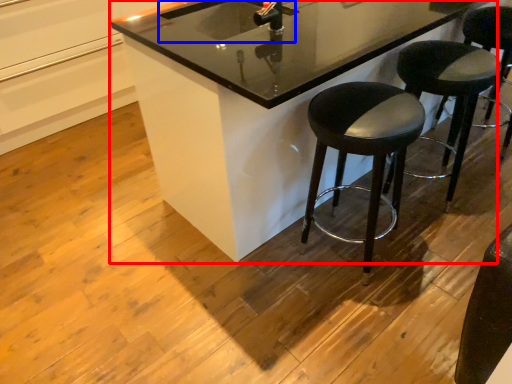
Question: Which object appears farthest to the camera in this image, counter (highlighted by a red box) or sink (highlighted by a blue box)?

Choices:
 (A) counter
 (B) sink

Answer: (B)